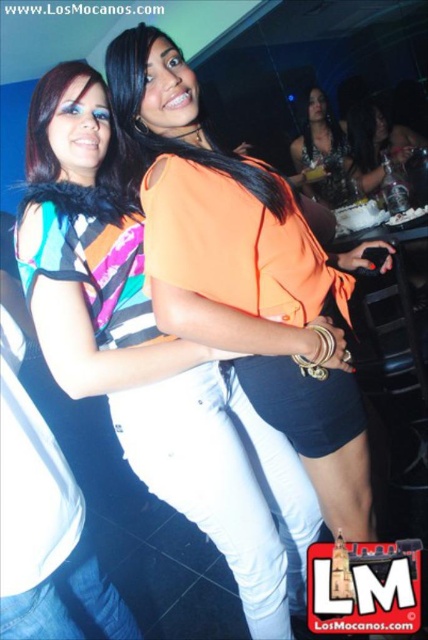
Is matte orange shirt at center to the right of satin black dress at center from the viewer's perspective?

No, matte orange shirt at center is not to the right of satin black dress at center.

Does matte orange shirt at center have a lesser height compared to satin black dress at center?

Incorrect, matte orange shirt at center's height does not fall short of satin black dress at center's.

Is point (299, 477) closer to viewer compared to point (311, 88)?

Yes, it is.

The image size is (428, 640). Identify the location of matte orange shirt at center. (151, 358).

Who is positioned more to the right, matte orange top at center or satin black dress at center?

matte orange top at center

Is matte orange top at center thinner than satin black dress at center?

No.

What do you see at coordinates (377, 144) in the screenshot? I see `matte orange top at center` at bounding box center [377, 144].

Identify the location of matte orange top at center. Image resolution: width=428 pixels, height=640 pixels. (377, 144).

Can you confirm if matte orange shirt at center is positioned above matte orange top at center?

Incorrect, matte orange shirt at center is not positioned above matte orange top at center.

Between matte orange shirt at center and matte orange top at center, which one appears on the left side from the viewer's perspective?

matte orange shirt at center

Locate an element on the screen. matte orange shirt at center is located at coordinates (151, 358).